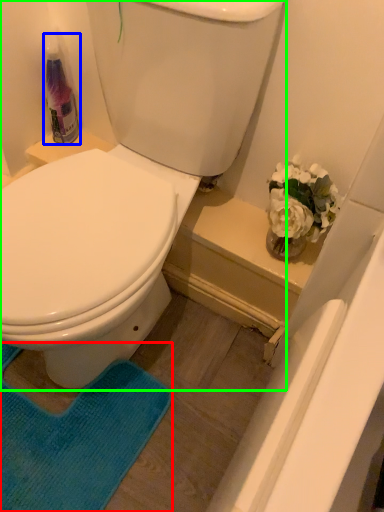
Question: Which object is the closest to the yoga mat (highlighted by a red box)? Choose among these: cleaning product (highlighted by a blue box) or toilet (highlighted by a green box).

Choices:
 (A) cleaning product
 (B) toilet

Answer: (B)